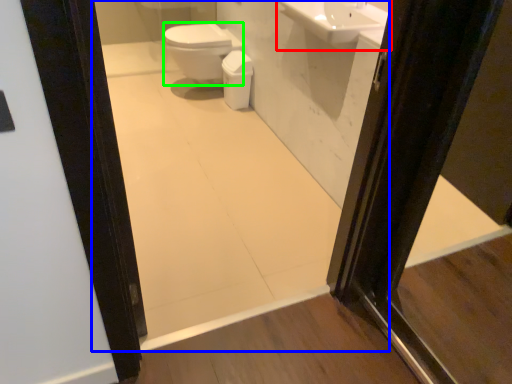
Question: Estimate the real-world distances between objects in this image. Which object is closer to sink (highlighted by a red box), mirror (highlighted by a blue box) or bidet (highlighted by a green box)?

Choices:
 (A) mirror
 (B) bidet

Answer: (A)